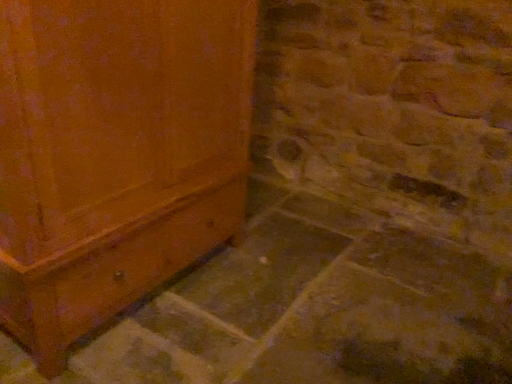
Question: From a real-world perspective, is smooth gray concrete at lower left located beneath matte wood cabinet at left?

Choices:
 (A) yes
 (B) no

Answer: (A)

Question: Can you confirm if smooth gray concrete at lower left is bigger than matte wood cabinet at left?

Choices:
 (A) no
 (B) yes

Answer: (A)

Question: Is smooth gray concrete at lower left wider than matte wood cabinet at left?

Choices:
 (A) yes
 (B) no

Answer: (A)

Question: Is smooth gray concrete at lower left taller than matte wood cabinet at left?

Choices:
 (A) no
 (B) yes

Answer: (A)

Question: Is smooth gray concrete at lower left facing away from matte wood cabinet at left?

Choices:
 (A) yes
 (B) no

Answer: (B)

Question: Does smooth gray concrete at lower left have a lesser width compared to matte wood cabinet at left?

Choices:
 (A) yes
 (B) no

Answer: (B)

Question: From the image's perspective, is matte wood cabinet at left under smooth gray concrete at lower left?

Choices:
 (A) no
 (B) yes

Answer: (A)

Question: Can you confirm if matte wood cabinet at left is wider than smooth gray concrete at lower left?

Choices:
 (A) no
 (B) yes

Answer: (A)

Question: Can we say matte wood cabinet at left lies outside smooth gray concrete at lower left?

Choices:
 (A) yes
 (B) no

Answer: (A)

Question: Can you see matte wood cabinet at left touching smooth gray concrete at lower left?

Choices:
 (A) yes
 (B) no

Answer: (B)

Question: Is matte wood cabinet at left in front of smooth gray concrete at lower left?

Choices:
 (A) no
 (B) yes

Answer: (A)

Question: Does matte wood cabinet at left have a smaller size compared to smooth gray concrete at lower left?

Choices:
 (A) yes
 (B) no

Answer: (B)

Question: In terms of size, does smooth gray concrete at lower left appear bigger or smaller than matte wood cabinet at left?

Choices:
 (A) big
 (B) small

Answer: (B)